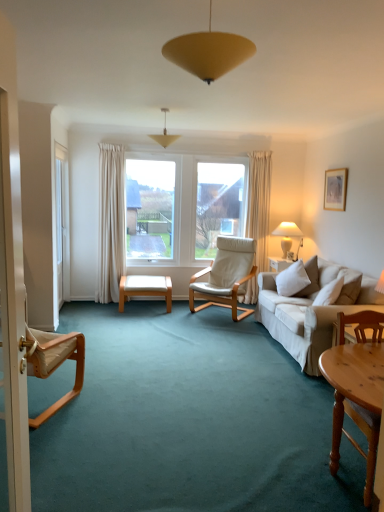
Describe the element at coordinates (208, 52) in the screenshot. This screenshot has height=512, width=384. I see `matte yellow cone at upper center, arranged as the 1th lamp when viewed from the front` at that location.

Where is `matte yellow cone at center, marked as the 2th lamp in a front-to-back arrangement`? The width and height of the screenshot is (384, 512). matte yellow cone at center, marked as the 2th lamp in a front-to-back arrangement is located at coordinates (164, 134).

This screenshot has width=384, height=512. What are the coordinates of `white ceramic lamp at right, the third lamp viewed from the front` in the screenshot? It's located at (289, 237).

You are a GUI agent. You are given a task and a screenshot of the screen. Output one action in this format:
    pyautogui.click(x=<x>, y=<y>)
    Task: Click on the matte yellow cone at upper center, which appears as the 2th lamp when viewed from the top
    The width and height of the screenshot is (384, 512).
    Given the screenshot: What is the action you would take?
    pyautogui.click(x=208, y=52)

From a real-world perspective, is matte yellow cone at upper center, the third lamp from the back, below beige fabric chair at left, which is the 2th chair from back to front?

No, from a real-world perspective, matte yellow cone at upper center, the third lamp from the back, is not under beige fabric chair at left, which is the 2th chair from back to front.

In terms of size, does matte yellow cone at upper center, which is counted as the 2th lamp, starting from the right, appear bigger or smaller than beige fabric chair at left, the third chair in the right-to-left sequence?

Considering their sizes, matte yellow cone at upper center, which is counted as the 2th lamp, starting from the right, takes up less space than beige fabric chair at left, the third chair in the right-to-left sequence.

Can you see matte yellow cone at upper center, which appears as the 2th lamp when viewed from the left, touching beige fabric chair at left, which is the 2th chair from back to front?

matte yellow cone at upper center, which appears as the 2th lamp when viewed from the left, and beige fabric chair at left, which is the 2th chair from back to front, are clearly separated.

Is matte yellow cone at upper center, the third lamp from the back, oriented towards beige fabric chair at left, the first chair when ordered from left to right?

No, matte yellow cone at upper center, the third lamp from the back, is not aimed at beige fabric chair at left, the first chair when ordered from left to right.

Visually, is wooden chair at lower right, which is the first chair from right to left, positioned to the left or to the right of white ceramic lamp at right, the 1th lamp viewed from the right?

wooden chair at lower right, which is the first chair from right to left, is positioned on white ceramic lamp at right, the 1th lamp viewed from the right,'s left side.

From the image's perspective, between wooden chair at lower right, which is counted as the 1th chair, starting from the front, and white ceramic lamp at right, which ranks as the first lamp in back-to-front order, who is located below?

wooden chair at lower right, which is counted as the 1th chair, starting from the front, is shown below in the image.

Does wooden chair at lower right, which is counted as the 1th chair, starting from the front, turn towards white ceramic lamp at right, marked as the 3th lamp in a top-to-bottom arrangement?

No, wooden chair at lower right, which is counted as the 1th chair, starting from the front, is not facing towards white ceramic lamp at right, marked as the 3th lamp in a top-to-bottom arrangement.

Would you say white ceramic lamp at right, placed as the 3th lamp when sorted from left to right, is part of wooden chair at lower right, which is counted as the 1th chair, starting from the front,'s contents?

No, white ceramic lamp at right, placed as the 3th lamp when sorted from left to right, is not inside wooden chair at lower right, which is counted as the 1th chair, starting from the front.

Which of these two, white plastic screen door at left or white leather chair at center, the 3th chair in the front-to-back sequence, is thinner?

white plastic screen door at left is thinner.

Based on the photo, from a real-world perspective, is white plastic screen door at left positioned under white leather chair at center, which is the 2th chair from right to left, based on gravity?

Actually, white plastic screen door at left is physically above white leather chair at center, which is the 2th chair from right to left, in the real world.

Does white plastic screen door at left come in front of white leather chair at center, the 3th chair in the front-to-back sequence?

Yes, white plastic screen door at left is in front of white leather chair at center, the 3th chair in the front-to-back sequence.

Can you see white plastic screen door at left touching white leather chair at center, which is the 2th chair from right to left?

No, white plastic screen door at left is not making contact with white leather chair at center, which is the 2th chair from right to left.

Is light wood bench at center oriented towards matte yellow cone at upper center, which is counted as the 2th lamp, starting from the right?

No, light wood bench at center is not facing towards matte yellow cone at upper center, which is counted as the 2th lamp, starting from the right.

Can you tell me how much light wood bench at center and matte yellow cone at upper center, which appears as the 2th lamp when viewed from the top, differ in facing direction?

There is a 170-degree angle between the facing directions of light wood bench at center and matte yellow cone at upper center, which appears as the 2th lamp when viewed from the top.

From the image's perspective, would you say light wood bench at center is shown under matte yellow cone at upper center, arranged as the 2th lamp when ordered from the bottom?

Yes, from the image's perspective, light wood bench at center is below matte yellow cone at upper center, arranged as the 2th lamp when ordered from the bottom.

Considering the sizes of objects light wood bench at center and matte yellow cone at upper center, arranged as the 2th lamp when ordered from the bottom, in the image provided, who is smaller, light wood bench at center or matte yellow cone at upper center, arranged as the 2th lamp when ordered from the bottom,?

Smaller between the two is matte yellow cone at upper center, arranged as the 2th lamp when ordered from the bottom.

Can you tell me how much white leather chair at center, the second chair positioned from the left, and wooden chair at lower right, the 3th chair when ordered from back to front, differ in facing direction?

white leather chair at center, the second chair positioned from the left, and wooden chair at lower right, the 3th chair when ordered from back to front, are facing 41.2 degrees away from each other.

Is white leather chair at center, the 3th chair in the front-to-back sequence, in front of or behind wooden chair at lower right, the 3th chair when ordered from back to front, in the image?

Visually, white leather chair at center, the 3th chair in the front-to-back sequence, is located behind wooden chair at lower right, the 3th chair when ordered from back to front.

Is point (193, 278) farther from camera compared to point (334, 329)?

Yes, point (193, 278) is behind point (334, 329).

Considering the positions of objects white leather chair at center, which is the 1th chair in back-to-front order, and wooden chair at lower right, which is the first chair from right to left, in the image provided, who is more to the left, white leather chair at center, which is the 1th chair in back-to-front order, or wooden chair at lower right, which is the first chair from right to left,?

white leather chair at center, which is the 1th chair in back-to-front order, is more to the left.

Which is more to the right, beige fabric chair at left, the third chair in the right-to-left sequence, or matte yellow cone at center, marked as the 3th lamp in a right-to-left arrangement?

Positioned to the right is matte yellow cone at center, marked as the 3th lamp in a right-to-left arrangement.

In terms of size, does beige fabric chair at left, the first chair when ordered from left to right, appear bigger or smaller than matte yellow cone at center, marked as the 3th lamp in a right-to-left arrangement?

Considering their sizes, beige fabric chair at left, the first chair when ordered from left to right, takes up more space than matte yellow cone at center, marked as the 3th lamp in a right-to-left arrangement.

From a real-world perspective, between beige fabric chair at left, the 2th chair when ordered from front to back, and matte yellow cone at center, acting as the first lamp starting from the top, who is vertically higher?

In real-world perspective, matte yellow cone at center, acting as the first lamp starting from the top, is above.

Is beige fabric chair at left, the third chair in the right-to-left sequence, turned away from matte yellow cone at center, acting as the first lamp starting from the top?

That's not correct — beige fabric chair at left, the third chair in the right-to-left sequence, is not looking away from matte yellow cone at center, acting as the first lamp starting from the top.

Does beige fabric chair at left, the first chair when ordered from left to right, contain white leather chair at center, the 3th chair in the front-to-back sequence?

No.

Does beige fabric chair at left, the third chair in the right-to-left sequence, have a lesser width compared to white leather chair at center, the 3th chair in the front-to-back sequence?

Yes, beige fabric chair at left, the third chair in the right-to-left sequence, is thinner than white leather chair at center, the 3th chair in the front-to-back sequence.

Which object is more forward, beige fabric chair at left, which is the 2th chair from back to front, or white leather chair at center, which is the 2th chair from right to left?

beige fabric chair at left, which is the 2th chair from back to front.

From the matte yellow cone at upper center, arranged as the 1th lamp when viewed from the front, count 2nd chairs backward and point to it. Please provide its 2D coordinates.

[(53, 361)]

Which chair is the 1st one when counting from the left side of the white ceramic lamp at right, the 1th lamp viewed from the right? Please provide its 2D coordinates.

[(353, 439)]

Which object lies further to the anchor point matte yellow cone at center, acting as the first lamp starting from the top, light wood bench at center or matte yellow cone at upper center, arranged as the 2th lamp when ordered from the bottom?

matte yellow cone at upper center, arranged as the 2th lamp when ordered from the bottom, is further to matte yellow cone at center, acting as the first lamp starting from the top.

Looking at the image, which one is located closer to white leather chair at center, which is the 1th chair in back-to-front order, matte yellow cone at center, marked as the third lamp in a bottom-to-top arrangement, or light wood bench at center?

light wood bench at center is closer to white leather chair at center, which is the 1th chair in back-to-front order.

From the image, which object appears to be farther from wooden chair at lower right, the third chair when ordered from left to right, white ceramic lamp at right, the 1th lamp viewed from the right, or white plastic screen door at left?

white plastic screen door at left.

Estimate the real-world distances between objects in this image. Which object is further from light wood bench at center, matte yellow cone at center, which appears as the 1th lamp when viewed from the left, or beige fabric chair at left, which is the 2th chair from back to front?

Among the two, beige fabric chair at left, which is the 2th chair from back to front, is located further to light wood bench at center.

When comparing their distances from white ceramic lamp at right, marked as the 3th lamp in a top-to-bottom arrangement, does matte yellow cone at center, marked as the 3th lamp in a right-to-left arrangement, or matte yellow cone at upper center, which appears as the 2th lamp when viewed from the top, seem further?

matte yellow cone at upper center, which appears as the 2th lamp when viewed from the top, is further to white ceramic lamp at right, marked as the 3th lamp in a top-to-bottom arrangement.

From the picture: Based on their spatial positions, is matte yellow cone at upper center, arranged as the 2th lamp when ordered from the bottom, or white plastic screen door at left further from light wood bench at center?

matte yellow cone at upper center, arranged as the 2th lamp when ordered from the bottom, is further to light wood bench at center.

When comparing their distances from beige fabric chair at left, the third chair in the right-to-left sequence, does white plastic screen door at left or wooden chair at lower right, the 3th chair when ordered from back to front, seem closer?

Among the two, wooden chair at lower right, the 3th chair when ordered from back to front, is located nearer to beige fabric chair at left, the third chair in the right-to-left sequence.

Consider the image. Which object lies further to the anchor point wooden chair at lower right, the third chair when ordered from left to right, matte white picture frame at upper right or white ceramic lamp at right, the 1th lamp viewed from the right?

white ceramic lamp at right, the 1th lamp viewed from the right.

The width and height of the screenshot is (384, 512). Identify the location of screen door positioned between matte yellow cone at upper center, which appears as the 2th lamp when viewed from the left, and white ceramic lamp at right, the first lamp ordered from the bottom, from near to far. (62, 223).

This screenshot has width=384, height=512. I want to click on screen door between wooden chair at lower right, the 3th chair when ordered from back to front, and white leather chair at center, the 3th chair in the front-to-back sequence, from front to back, so click(62, 223).

I want to click on lamp located between wooden chair at lower right, which is counted as the 1th chair, starting from the front, and white ceramic lamp at right, marked as the 3th lamp in a top-to-bottom arrangement, in the depth direction, so click(164, 134).

This screenshot has width=384, height=512. Identify the location of screen door between matte yellow cone at upper center, which is counted as the 2th lamp, starting from the right, and light wood bench at center in the front-back direction. (62, 223).